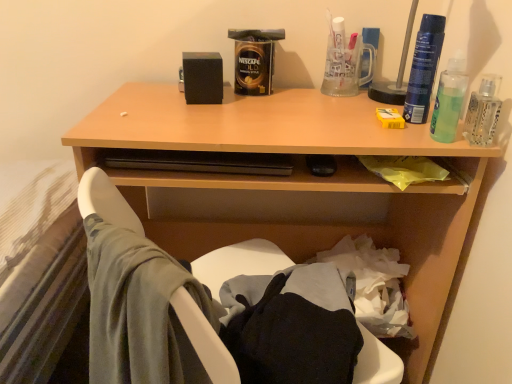
Question: Would you say blue plastic spray can at upper right, the 1th bottle viewed from the left, is outside green translucent liquid at upper right?

Choices:
 (A) yes
 (B) no

Answer: (A)

Question: Can you confirm if blue plastic spray can at upper right, acting as the second bottle starting from the right, is shorter than green translucent liquid at upper right?

Choices:
 (A) no
 (B) yes

Answer: (A)

Question: Is blue plastic spray can at upper right, acting as the second bottle starting from the right, further to the viewer compared to green translucent liquid at upper right?

Choices:
 (A) yes
 (B) no

Answer: (A)

Question: From a real-world perspective, is blue plastic spray can at upper right, the 1th bottle viewed from the left, located higher than green translucent liquid at upper right?

Choices:
 (A) no
 (B) yes

Answer: (B)

Question: From the image's perspective, is blue plastic spray can at upper right, acting as the second bottle starting from the right, beneath green translucent liquid at upper right?

Choices:
 (A) no
 (B) yes

Answer: (A)

Question: Considering the relative sizes of blue plastic spray can at upper right, the 1th bottle viewed from the left, and green translucent liquid at upper right in the image provided, is blue plastic spray can at upper right, the 1th bottle viewed from the left, bigger than green translucent liquid at upper right?

Choices:
 (A) yes
 (B) no

Answer: (B)

Question: Can you confirm if blue plastic spray can at upper right, the 1th bottle viewed from the left, is bigger than wooden desk at upper center?

Choices:
 (A) yes
 (B) no

Answer: (B)

Question: Is blue plastic spray can at upper right, the 1th bottle viewed from the left, positioned far away from wooden desk at upper center?

Choices:
 (A) no
 (B) yes

Answer: (A)

Question: Is blue plastic spray can at upper right, the 1th bottle viewed from the left, behind wooden desk at upper center?

Choices:
 (A) yes
 (B) no

Answer: (A)

Question: From a real-world perspective, is blue plastic spray can at upper right, acting as the second bottle starting from the right, located higher than wooden desk at upper center?

Choices:
 (A) yes
 (B) no

Answer: (A)

Question: Considering the relative positions of blue plastic spray can at upper right, the 1th bottle viewed from the left, and wooden desk at upper center in the image provided, is blue plastic spray can at upper right, the 1th bottle viewed from the left, to the right of wooden desk at upper center from the viewer's perspective?

Choices:
 (A) no
 (B) yes

Answer: (B)

Question: Is blue plastic spray can at upper right, the 1th bottle viewed from the left, in front of wooden desk at upper center?

Choices:
 (A) yes
 (B) no

Answer: (B)

Question: Could you tell me if wooden desk at upper center is turned towards clear glass bottle at upper right, the first bottle in the right-to-left sequence?

Choices:
 (A) no
 (B) yes

Answer: (A)